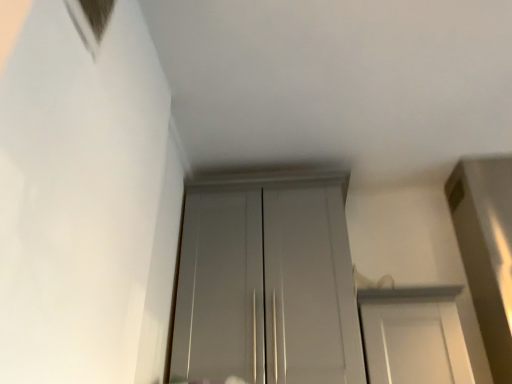
Question: In terms of size, does white glossy door at center, which is counted as the second door, starting from the left, appear bigger or smaller than glossy white door at center, positioned as the second door in right-to-left order?

Choices:
 (A) big
 (B) small

Answer: (B)

Question: Is white glossy door at center, which is counted as the first door, starting from the right, spatially inside glossy white door at center, the first door in the left-to-right sequence, or outside of it?

Choices:
 (A) outside
 (B) inside

Answer: (A)

Question: In terms of width, does white glossy door at center, which is counted as the second door, starting from the left, look wider or thinner when compared to glossy white door at center, the first door in the left-to-right sequence?

Choices:
 (A) thin
 (B) wide

Answer: (B)

Question: Is glossy white door at center, the first door in the left-to-right sequence, spatially inside white glossy door at center, which is counted as the second door, starting from the left, or outside of it?

Choices:
 (A) inside
 (B) outside

Answer: (B)

Question: In terms of width, does glossy white door at center, the first door in the left-to-right sequence, look wider or thinner when compared to white glossy door at center, which is counted as the second door, starting from the left?

Choices:
 (A) thin
 (B) wide

Answer: (A)

Question: Considering the positions of glossy white door at center, the first door in the left-to-right sequence, and white glossy door at center, which is counted as the first door, starting from the right, in the image, is glossy white door at center, the first door in the left-to-right sequence, taller or shorter than white glossy door at center, which is counted as the first door, starting from the right,?

Choices:
 (A) tall
 (B) short

Answer: (A)

Question: Is point (264, 215) closer or farther from the camera than point (398, 365)?

Choices:
 (A) closer
 (B) farther

Answer: (B)